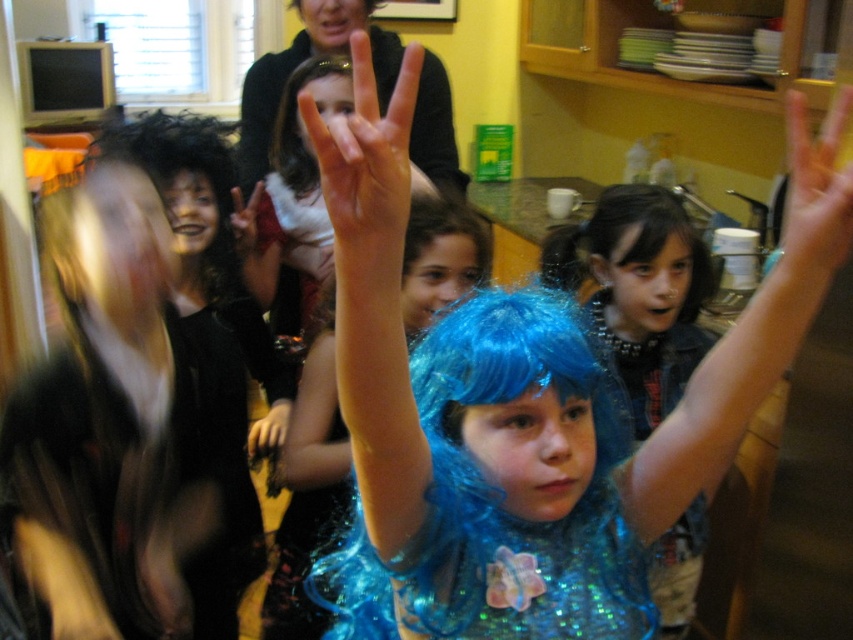
Based on the photo, is blue sequined wig at center wider than black velvet wig at left?

Yes.

Is blue sequined wig at center smaller than black velvet wig at left?

Actually, blue sequined wig at center might be larger than black velvet wig at left.

The height and width of the screenshot is (640, 853). What do you see at coordinates (639, 291) in the screenshot? I see `blue sequined wig at center` at bounding box center [639, 291].

You are a GUI agent. You are given a task and a screenshot of the screen. Output one action in this format:
    pyautogui.click(x=<x>, y=<y>)
    Task: Click on the blue sequined wig at center
    
    Given the screenshot: What is the action you would take?
    pyautogui.click(x=639, y=291)

Is blue glitter wig at center positioned behind dark brown silky hair at center?

That is False.

At what (x,y) coordinates should I click in order to perform the action: click on blue glitter wig at center. Please return your answer as a coordinate pair (x, y). This screenshot has width=853, height=640. Looking at the image, I should click on (509, 410).

This screenshot has height=640, width=853. In order to click on blue glitter wig at center in this screenshot , I will do `click(509, 410)`.

Can you confirm if curly black hair at left is thinner than dark brown silky hair at center?

Indeed, curly black hair at left has a lesser width compared to dark brown silky hair at center.

Between curly black hair at left and dark brown silky hair at center, which one is positioned lower?

curly black hair at left is below.

This screenshot has width=853, height=640. What do you see at coordinates (184, 170) in the screenshot? I see `curly black hair at left` at bounding box center [184, 170].

Image resolution: width=853 pixels, height=640 pixels. What are the coordinates of `curly black hair at left` in the screenshot? It's located at (184, 170).